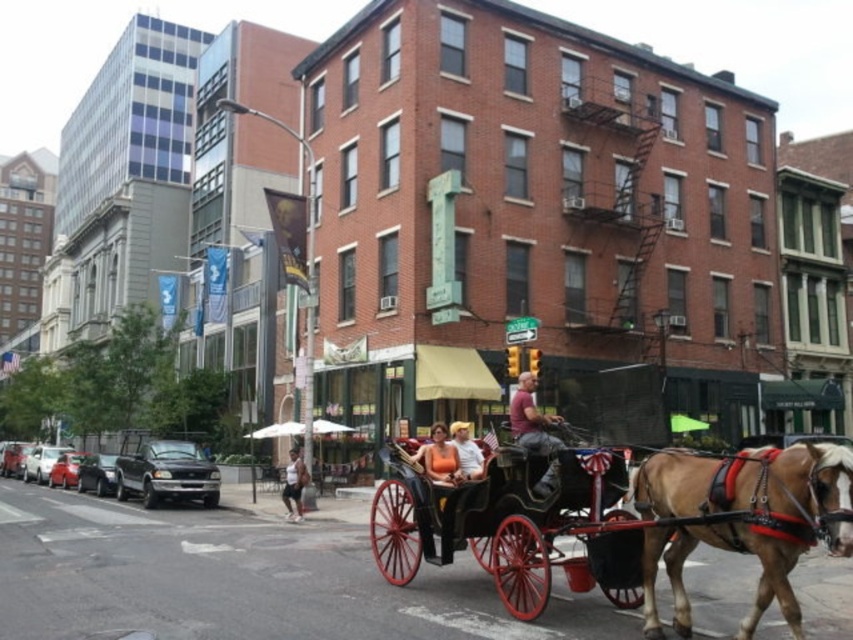
Question: Does orange fabric shirt at center lie in front of orange fabric dress at center?

Choices:
 (A) yes
 (B) no

Answer: (B)

Question: Among these objects, which one is nearest to the camera?

Choices:
 (A) wooden polished horse cart at center
 (B) brown glossy horse at lower right

Answer: (A)

Question: Which point is closer to the camera?

Choices:
 (A) (511, 500)
 (B) (436, 442)
 (C) (747, 451)

Answer: (C)

Question: Is wooden polished horse cart at center bigger than matte red shirt at center?

Choices:
 (A) yes
 (B) no

Answer: (A)

Question: Which object is the closest to the matte red shirt at center?

Choices:
 (A) orange fabric dress at center
 (B) brown glossy horse at lower right

Answer: (A)

Question: Can you confirm if wooden polished horse cart at center is positioned above matte red shirt at center?

Choices:
 (A) yes
 (B) no

Answer: (B)